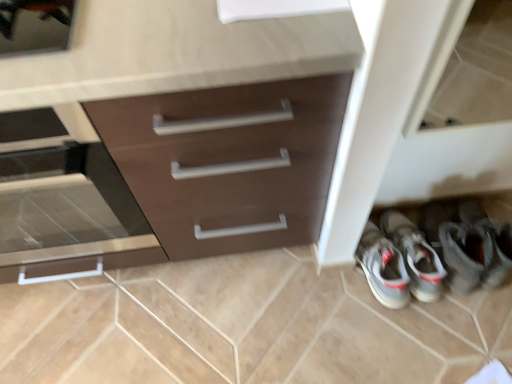
This screenshot has width=512, height=384. Describe the element at coordinates (170, 136) in the screenshot. I see `brown matte cabinet at center` at that location.

Locate an element on the screen. The height and width of the screenshot is (384, 512). matte brown drawer at left is located at coordinates (x=65, y=205).

Image resolution: width=512 pixels, height=384 pixels. I want to click on brown matte cabinet at center, so click(x=170, y=136).

Locate an element on the screen. Image resolution: width=512 pixels, height=384 pixels. chest of drawers above the gray fabric sneakers at lower right (from a real-world perspective) is located at coordinates (170, 136).

Is brown matte cabinet at center a part of gray fabric sneakers at lower right?

Definitely not — brown matte cabinet at center is not inside gray fabric sneakers at lower right.

Is gray fabric sneakers at lower right far away from brown matte cabinet at center?

That's not correct — gray fabric sneakers at lower right is a little close to brown matte cabinet at center.

How far apart are gray fabric sneakers at lower right and matte brown drawer at left?

gray fabric sneakers at lower right is 33.19 inches away from matte brown drawer at left.

Which object is closer to the camera, gray fabric sneakers at lower right or matte brown drawer at left?

Positioned in front is matte brown drawer at left.

Based on the photo, can you confirm if gray fabric sneakers at lower right is wider than matte brown drawer at left?

In fact, gray fabric sneakers at lower right might be narrower than matte brown drawer at left.

Which is more to the right, gray fabric sneakers at lower right or matte brown drawer at left?

Positioned to the right is gray fabric sneakers at lower right.

Looking at this image, from a real-world perspective, relative to matte brown drawer at left, is brown matte cabinet at center vertically above or below?

brown matte cabinet at center is below matte brown drawer at left.

How far apart are brown matte cabinet at center and matte brown drawer at left?

A distance of 5.15 inches exists between brown matte cabinet at center and matte brown drawer at left.

Between brown matte cabinet at center and matte brown drawer at left, which one has more height?

brown matte cabinet at center.

Locate an element on the screen. The width and height of the screenshot is (512, 384). drawer behind the brown matte cabinet at center is located at coordinates (65, 205).

You are a GUI agent. You are given a task and a screenshot of the screen. Output one action in this format:
    pyautogui.click(x=<x>, y=<y>)
    Task: Click on the drawer that appears above the gray fabric sneakers at lower right (from the image's perspective)
    
    Given the screenshot: What is the action you would take?
    pyautogui.click(x=65, y=205)

From the image's perspective, who appears lower, matte brown drawer at left or gray fabric sneakers at lower right?

gray fabric sneakers at lower right is shown below in the image.

Is matte brown drawer at left placed right next to gray fabric sneakers at lower right?

They are not placed beside each other.

Between point (77, 235) and point (507, 270), which one is positioned behind?

The point (507, 270) is behind.

Is matte brown drawer at left thinner than brown matte cabinet at center?

Indeed, matte brown drawer at left has a lesser width compared to brown matte cabinet at center.

Which is farther, (x=91, y=159) or (x=293, y=170)?

Point (x=293, y=170)

How different are the orientations of matte brown drawer at left and brown matte cabinet at center in degrees?

The angle between the facing direction of matte brown drawer at left and the facing direction of brown matte cabinet at center is 1.74e-05 degrees.

Does matte brown drawer at left appear on the left side of brown matte cabinet at center?

Correct, you'll find matte brown drawer at left to the left of brown matte cabinet at center.

Is brown matte cabinet at center situated inside gray fabric sneakers at lower right or outside?

brown matte cabinet at center is outside gray fabric sneakers at lower right.

Is brown matte cabinet at center positioned with its back to gray fabric sneakers at lower right?

No, brown matte cabinet at center is not facing away from gray fabric sneakers at lower right.

Who is smaller, brown matte cabinet at center or gray fabric sneakers at lower right?

With smaller size is gray fabric sneakers at lower right.

I want to click on footwear below the brown matte cabinet at center (from the image's perspective), so click(436, 251).

Find the location of `footwear behind the matte brown drawer at left`. footwear behind the matte brown drawer at left is located at coordinates (436, 251).

From the image, which object appears to be nearer to gray fabric sneakers at lower right, brown matte cabinet at center or matte brown drawer at left?

brown matte cabinet at center.

Considering their positions, is brown matte cabinet at center positioned further to matte brown drawer at left than gray fabric sneakers at lower right?

gray fabric sneakers at lower right.

From the image, which object appears to be farther from brown matte cabinet at center, matte brown drawer at left or gray fabric sneakers at lower right?

gray fabric sneakers at lower right is further to brown matte cabinet at center.

Based on their spatial positions, is gray fabric sneakers at lower right or brown matte cabinet at center further from matte brown drawer at left?

gray fabric sneakers at lower right is positioned further to the anchor matte brown drawer at left.

When comparing their distances from brown matte cabinet at center, does gray fabric sneakers at lower right or matte brown drawer at left seem further?

gray fabric sneakers at lower right lies further to brown matte cabinet at center than the other object.

Considering their positions, is matte brown drawer at left positioned closer to gray fabric sneakers at lower right than brown matte cabinet at center?

brown matte cabinet at center.

Find the location of a particular element. This screenshot has width=512, height=384. the chest of drawers situated between matte brown drawer at left and gray fabric sneakers at lower right from left to right is located at coordinates (170, 136).